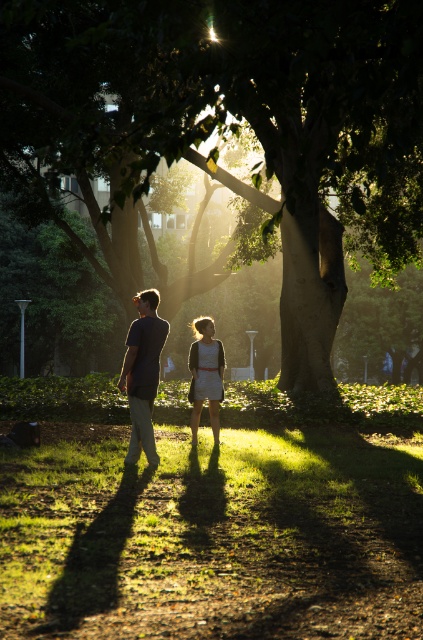
Does green leafy tree at center appear over matte white dress at center?

Correct, green leafy tree at center is located above matte white dress at center.

Does point (294, 35) come farther from viewer compared to point (189, 364)?

No, it is not.

Locate an element on the screen. The width and height of the screenshot is (423, 640). green leafy tree at center is located at coordinates (239, 120).

Is point (143, 346) positioned before point (200, 340)?

That is True.

Does matte gray shirt at center have a smaller size compared to matte white dress at center?

Actually, matte gray shirt at center might be larger than matte white dress at center.

You are a GUI agent. You are given a task and a screenshot of the screen. Output one action in this format:
    pyautogui.click(x=<x>, y=<y>)
    Task: Click on the matte gray shirt at center
    The image size is (423, 640).
    Given the screenshot: What is the action you would take?
    pyautogui.click(x=142, y=372)

Between green leafy tree at center and matte gray shirt at center, which one is positioned lower?

matte gray shirt at center is below.

Can you confirm if green leafy tree at center is smaller than matte gray shirt at center?

No.

Between point (13, 157) and point (134, 456), which one is positioned behind?

Positioned behind is point (13, 157).

Where is `green leafy tree at center`? green leafy tree at center is located at coordinates (239, 120).